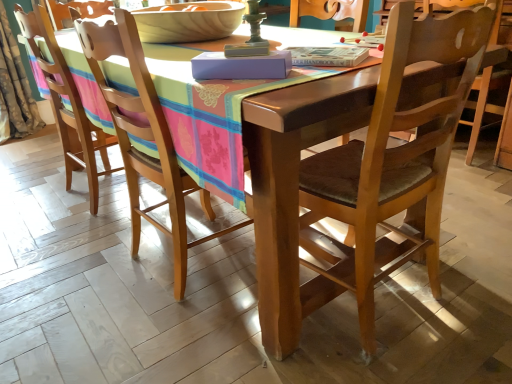
What is the approximate width of camouflage fabric curtain at left?

camouflage fabric curtain at left is 9.50 inches wide.

The image size is (512, 384). Identify the location of wooden chair at center, which is counted as the 1th chair, starting from the right. (392, 163).

Describe the element at coordinates (67, 110) in the screenshot. The height and width of the screenshot is (384, 512). I see `wooden chair at center, which ranks as the 3th chair in right-to-left order` at that location.

Locate an element on the screen. The width and height of the screenshot is (512, 384). camouflage fabric curtain at left is located at coordinates (14, 89).

Between wooden chair at left, arranged as the second chair when viewed from the left, and wooden chair at center, which ranks as the 3th chair in right-to-left order, which one is positioned behind?

wooden chair at center, which ranks as the 3th chair in right-to-left order, is further from the camera.

Considering the sizes of objects wooden chair at left, arranged as the second chair when viewed from the left, and wooden chair at center, positioned as the first chair in left-to-right order, in the image provided, who is wider, wooden chair at left, arranged as the second chair when viewed from the left, or wooden chair at center, positioned as the first chair in left-to-right order,?

wooden chair at center, positioned as the first chair in left-to-right order, is wider.

Image resolution: width=512 pixels, height=384 pixels. Identify the location of the 1st chair below the wooden chair at center, which ranks as the 3th chair in right-to-left order (from the image's perspective). (145, 138).

Is wooden chair at left, arranged as the second chair when viewed from the left, looking in the opposite direction of wooden chair at center, which ranks as the 3th chair in right-to-left order?

No, wooden chair at center, which ranks as the 3th chair in right-to-left order, is not at the back of wooden chair at left, arranged as the second chair when viewed from the left.

From the image's perspective, between wooden chair at left, which is the second chair from right to left, and wooden bowl at upper center, which one is located above?

wooden bowl at upper center is shown above in the image.

Does wooden chair at left, arranged as the second chair when viewed from the left, come in front of wooden bowl at upper center?

Yes.

Locate an element on the screen. The width and height of the screenshot is (512, 384). bowl behind the wooden chair at left, arranged as the second chair when viewed from the left is located at coordinates (188, 22).

From the image's perspective, which is above, camouflage fabric curtain at left or wooden bowl at upper center?

camouflage fabric curtain at left is shown above in the image.

From a real-world perspective, which is physically above, camouflage fabric curtain at left or wooden bowl at upper center?

wooden bowl at upper center.

From the picture: Considering the relative positions of camouflage fabric curtain at left and wooden bowl at upper center in the image provided, is camouflage fabric curtain at left in front of wooden bowl at upper center?

No, camouflage fabric curtain at left is behind wooden bowl at upper center.

How many degrees apart are the facing directions of camouflage fabric curtain at left and wooden bowl at upper center?

camouflage fabric curtain at left and wooden bowl at upper center are facing 87 degrees away from each other.

Is wooden bowl at upper center shorter than wooden chair at left, which is the second chair from right to left?

Yes, wooden bowl at upper center is shorter than wooden chair at left, which is the second chair from right to left.

Is wooden bowl at upper center in contact with wooden chair at left, arranged as the second chair when viewed from the left?

wooden bowl at upper center and wooden chair at left, arranged as the second chair when viewed from the left, are not in contact.

Which of these two, wooden bowl at upper center or wooden chair at left, which is the second chair from right to left, is smaller?

With smaller size is wooden bowl at upper center.

Which is more to the right, wooden bowl at upper center or wooden chair at left, which is the second chair from right to left?

Positioned to the right is wooden chair at left, which is the second chair from right to left.

From a real-world perspective, is wooden chair at left, arranged as the second chair when viewed from the left, positioned under wooden chair at center, which is counted as the third chair, starting from the left, based on gravity?

No, from a real-world perspective, wooden chair at left, arranged as the second chair when viewed from the left, is not under wooden chair at center, which is counted as the third chair, starting from the left.

How much distance is there between wooden chair at left, which is the second chair from right to left, and wooden chair at center, which is counted as the 1th chair, starting from the right?

wooden chair at left, which is the second chair from right to left, and wooden chair at center, which is counted as the 1th chair, starting from the right, are 22.04 inches apart.

Is there a large distance between wooden chair at left, arranged as the second chair when viewed from the left, and wooden chair at center, which is counted as the 1th chair, starting from the right?

No, wooden chair at left, arranged as the second chair when viewed from the left, is not far away from wooden chair at center, which is counted as the 1th chair, starting from the right.

Is wooden chair at left, which is the second chair from right to left, bigger than wooden chair at center, which is counted as the third chair, starting from the left?

Indeed, wooden chair at left, which is the second chair from right to left, has a larger size compared to wooden chair at center, which is counted as the third chair, starting from the left.

How far apart are wooden bowl at upper center and wooden chair at center, which is counted as the third chair, starting from the left?

wooden bowl at upper center is 33.23 inches from wooden chair at center, which is counted as the third chair, starting from the left.

Locate an element on the screen. bowl positioned vertically above the wooden chair at center, which is counted as the third chair, starting from the left (from a real-world perspective) is located at coordinates (188, 22).

How many degrees apart are the facing directions of wooden bowl at upper center and wooden chair at center, which is counted as the third chair, starting from the left?

There is a 91.4-degree angle between the facing directions of wooden bowl at upper center and wooden chair at center, which is counted as the third chair, starting from the left.

Could you tell me if wooden bowl at upper center is turned towards wooden chair at center, which is counted as the 1th chair, starting from the right?

No, wooden bowl at upper center is not aimed at wooden chair at center, which is counted as the 1th chair, starting from the right.

Which object is positioned more to the right, wooden chair at center, which is counted as the 1th chair, starting from the right, or camouflage fabric curtain at left?

Positioned to the right is wooden chair at center, which is counted as the 1th chair, starting from the right.

Considering the sizes of objects wooden chair at center, which is counted as the 1th chair, starting from the right, and camouflage fabric curtain at left in the image provided, who is thinner, wooden chair at center, which is counted as the 1th chair, starting from the right, or camouflage fabric curtain at left?

camouflage fabric curtain at left.

Is point (250, 159) farther from camera compared to point (8, 22)?

No, (250, 159) is closer to viewer.

The width and height of the screenshot is (512, 384). I want to click on curtain above the wooden chair at center, which is counted as the third chair, starting from the left (from the image's perspective), so click(x=14, y=89).

Locate an element on the screen. Image resolution: width=512 pixels, height=384 pixels. the 1st chair to the right when counting from the wooden chair at center, which ranks as the 3th chair in right-to-left order is located at coordinates (145, 138).

The height and width of the screenshot is (384, 512). There is a wooden bowl at upper center. Identify the location of the 2nd chair below it (from a real-world perspective). (145, 138).

When comparing their distances from wooden chair at center, which is counted as the 1th chair, starting from the right, does wooden chair at left, which is the second chair from right to left, or wooden bowl at upper center seem further?

wooden bowl at upper center is further to wooden chair at center, which is counted as the 1th chair, starting from the right.

Considering their positions, is wooden bowl at upper center positioned closer to wooden chair at center, which is counted as the third chair, starting from the left, than wooden chair at center, which ranks as the 3th chair in right-to-left order?

wooden bowl at upper center is positioned closer to the anchor wooden chair at center, which is counted as the third chair, starting from the left.

When comparing their distances from wooden chair at left, which is the second chair from right to left, does wooden chair at center, positioned as the first chair in left-to-right order, or camouflage fabric curtain at left seem further?

camouflage fabric curtain at left.

Looking at the image, which one is located closer to wooden chair at left, arranged as the second chair when viewed from the left, camouflage fabric curtain at left or wooden chair at center, which is counted as the third chair, starting from the left?

wooden chair at center, which is counted as the third chair, starting from the left, lies closer to wooden chair at left, arranged as the second chair when viewed from the left, than the other object.

From the image, which object appears to be nearer to wooden chair at center, which is counted as the 1th chair, starting from the right, camouflage fabric curtain at left or wooden chair at center, which ranks as the 3th chair in right-to-left order?

Based on the image, wooden chair at center, which ranks as the 3th chair in right-to-left order, appears to be nearer to wooden chair at center, which is counted as the 1th chair, starting from the right.

Estimate the real-world distances between objects in this image. Which object is further from camouflage fabric curtain at left, wooden chair at left, arranged as the second chair when viewed from the left, or wooden chair at center, which is counted as the third chair, starting from the left?

The object further to camouflage fabric curtain at left is wooden chair at center, which is counted as the third chair, starting from the left.

Based on the photo, looking at the image, which one is located further to wooden chair at left, which is the second chair from right to left, camouflage fabric curtain at left or wooden bowl at upper center?

The object further to wooden chair at left, which is the second chair from right to left, is camouflage fabric curtain at left.

Estimate the real-world distances between objects in this image. Which object is further from wooden chair at center, which is counted as the third chair, starting from the left, wooden chair at center, positioned as the first chair in left-to-right order, or wooden bowl at upper center?

wooden chair at center, positioned as the first chair in left-to-right order, is positioned further to the anchor wooden chair at center, which is counted as the third chair, starting from the left.

Where is `bowl between wooden chair at center, which ranks as the 3th chair in right-to-left order, and wooden chair at center, which is counted as the 1th chair, starting from the right, in the horizontal direction`? This screenshot has width=512, height=384. bowl between wooden chair at center, which ranks as the 3th chair in right-to-left order, and wooden chair at center, which is counted as the 1th chair, starting from the right, in the horizontal direction is located at coordinates (188, 22).

At what (x,y) coordinates should I click in order to perform the action: click on chair between wooden chair at left, which is the second chair from right to left, and camouflage fabric curtain at left from front to back. Please return your answer as a coordinate pair (x, y). The height and width of the screenshot is (384, 512). Looking at the image, I should click on (67, 110).

In order to click on bowl between camouflage fabric curtain at left and wooden chair at center, which is counted as the third chair, starting from the left in this screenshot , I will do `click(188, 22)`.

You are a GUI agent. You are given a task and a screenshot of the screen. Output one action in this format:
    pyautogui.click(x=<x>, y=<y>)
    Task: Click on the chair between camouflage fabric curtain at left and wooden bowl at upper center from left to right
    
    Given the screenshot: What is the action you would take?
    pyautogui.click(x=67, y=110)